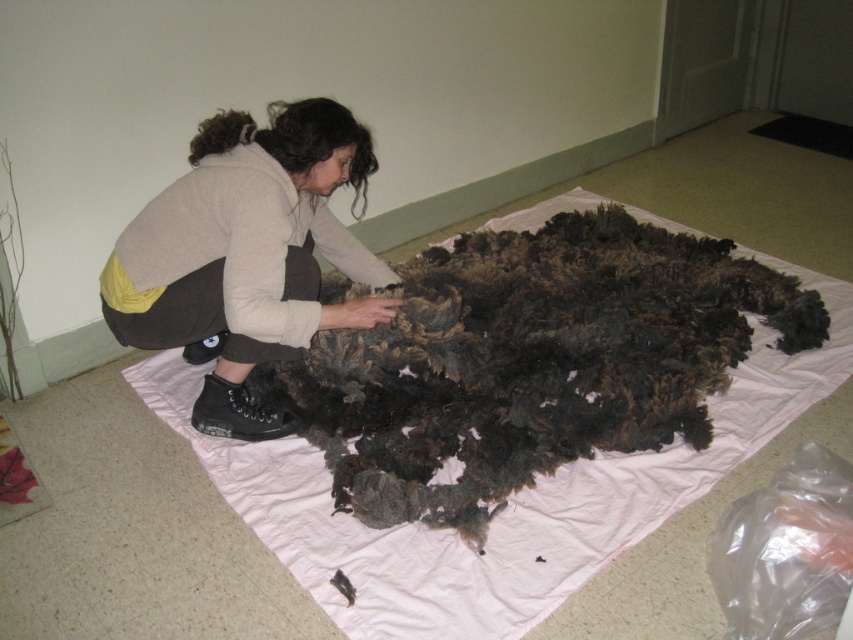
Who is lower down, fuzzy woolen blanket at center or matte beige sweater at center?

fuzzy woolen blanket at center is lower down.

You are a GUI agent. You are given a task and a screenshot of the screen. Output one action in this format:
    pyautogui.click(x=<x>, y=<y>)
    Task: Click on the fuzzy woolen blanket at center
    The image size is (853, 640).
    Given the screenshot: What is the action you would take?
    pyautogui.click(x=508, y=499)

Locate an element on the screen. Image resolution: width=853 pixels, height=640 pixels. fuzzy woolen blanket at center is located at coordinates (508, 499).